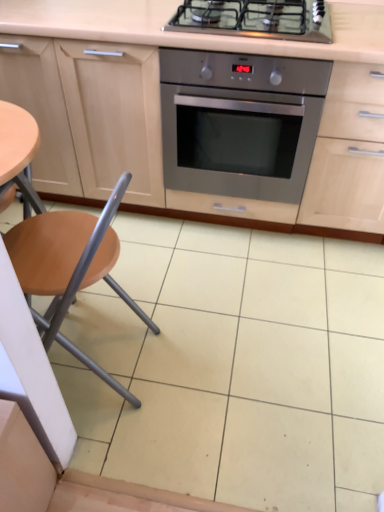
Question: Is wooden seat at left in front of or behind stainless steel oven at center in the image?

Choices:
 (A) behind
 (B) front

Answer: (B)

Question: From their relative heights in the image, would you say wooden seat at left is taller or shorter than stainless steel oven at center?

Choices:
 (A) short
 (B) tall

Answer: (B)

Question: Estimate the real-world distances between objects in this image. Which object is farther from the stainless steel gas stove at upper center?

Choices:
 (A) wooden seat at left
 (B) stainless steel oven at center
 (C) matte wood cabinetry at center

Answer: (A)

Question: Which object is positioned closest to the stainless steel oven at center?

Choices:
 (A) matte wood cabinetry at center
 (B) stainless steel gas stove at upper center
 (C) wooden seat at left

Answer: (A)